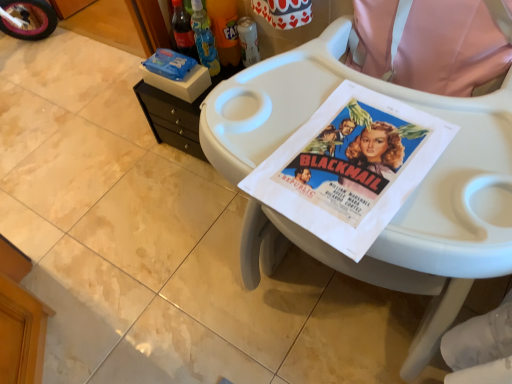
Identify the location of vacant area that is situated to the right of white glossy tile at lower left. (149, 302).